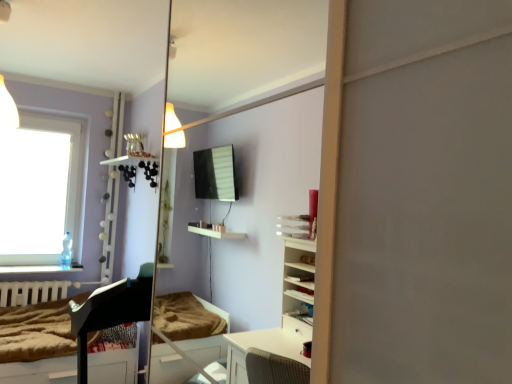
Question: From the image's perspective, would you say clear glass window at upper left is positioned over brown textured mattress at lower left?

Choices:
 (A) yes
 (B) no

Answer: (A)

Question: Is clear glass window at upper left bigger than brown textured mattress at lower left?

Choices:
 (A) yes
 (B) no

Answer: (B)

Question: Is clear glass window at upper left smaller than brown textured mattress at lower left?

Choices:
 (A) yes
 (B) no

Answer: (A)

Question: From the image's perspective, is clear glass window at upper left located beneath brown textured mattress at lower left?

Choices:
 (A) yes
 (B) no

Answer: (B)

Question: Is clear glass window at upper left positioned behind brown textured mattress at lower left?

Choices:
 (A) yes
 (B) no

Answer: (A)

Question: Choose the correct answer: Is clear glass window at upper left inside white matte radiator at lower left or outside it?

Choices:
 (A) outside
 (B) inside

Answer: (A)

Question: From the image's perspective, is clear glass window at upper left positioned above or below white matte radiator at lower left?

Choices:
 (A) below
 (B) above

Answer: (B)

Question: Looking at their shapes, would you say clear glass window at upper left is wider or thinner than white matte radiator at lower left?

Choices:
 (A) wide
 (B) thin

Answer: (B)

Question: From a real-world perspective, is clear glass window at upper left positioned above or below white matte radiator at lower left?

Choices:
 (A) above
 (B) below

Answer: (A)

Question: From the image's perspective, relative to clear glass window at upper left, is white matte radiator at lower left above or below?

Choices:
 (A) below
 (B) above

Answer: (A)

Question: In terms of height, does white matte radiator at lower left look taller or shorter compared to clear glass window at upper left?

Choices:
 (A) short
 (B) tall

Answer: (A)

Question: Considering their positions, is white matte radiator at lower left located in front of or behind clear glass window at upper left?

Choices:
 (A) behind
 (B) front

Answer: (B)

Question: Does point tap(57, 289) appear closer or farther from the camera than point tap(19, 256)?

Choices:
 (A) farther
 (B) closer

Answer: (B)

Question: Is black glossy piano at lower left in front of or behind white matte radiator at lower left in the image?

Choices:
 (A) behind
 (B) front

Answer: (B)

Question: Do you think black glossy piano at lower left is within white matte radiator at lower left, or outside of it?

Choices:
 (A) inside
 (B) outside

Answer: (B)